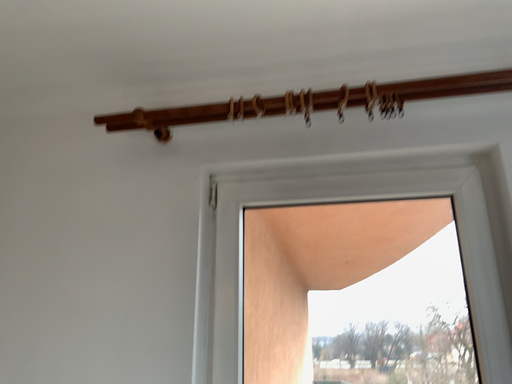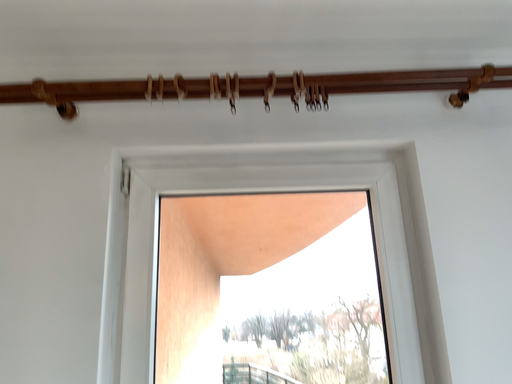
Question: Which way did the camera rotate in the video?

Choices:
 (A) rotated right
 (B) rotated left

Answer: (A)